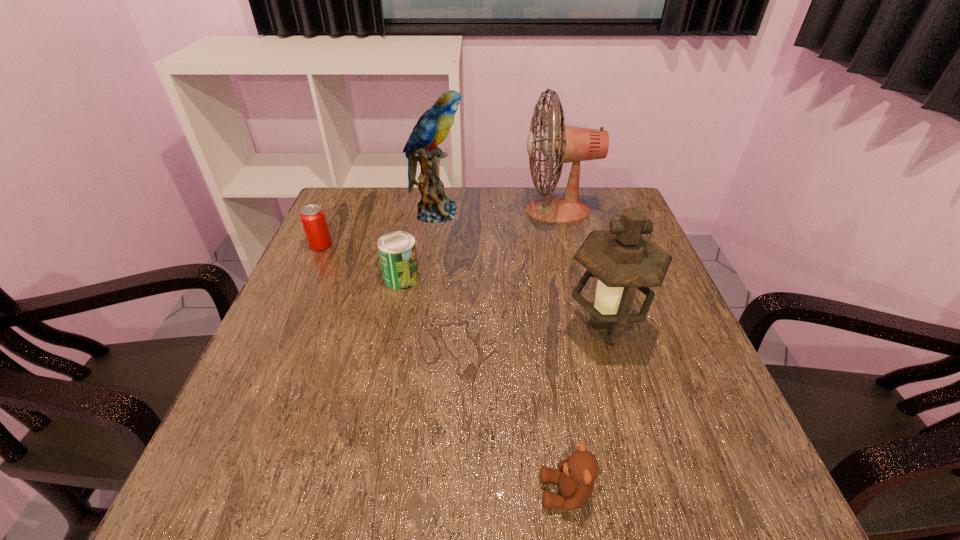
The width and height of the screenshot is (960, 540). I want to click on vacant space that is in between the third farthest object and the parrot, so click(378, 229).

At what (x,y) coordinates should I click in order to perform the action: click on empty space that is in between the parrot and the nearest object. Please return your answer as a coordinate pair (x, y). The height and width of the screenshot is (540, 960). Looking at the image, I should click on (501, 353).

This screenshot has width=960, height=540. Find the location of `free space that is in between the right can and the parrot`. free space that is in between the right can and the parrot is located at coordinates (419, 245).

Identify the location of free area in between the fan and the left can. pos(440,228).

Locate an element on the screen. free space between the right can and the nearest object is located at coordinates (484, 385).

Locate an element on the screen. free space between the parrot and the right can is located at coordinates (419, 245).

Find the location of a particular element. This screenshot has width=960, height=540. empty space that is in between the nearest object and the fan is located at coordinates (562, 352).

Identify the location of free spot between the third tallest object and the parrot. The width and height of the screenshot is (960, 540). (520, 271).

At what (x,y) coordinates should I click in order to perform the action: click on free space between the fan and the left can. Please return your answer as a coordinate pair (x, y). The width and height of the screenshot is (960, 540). Looking at the image, I should click on coord(440,228).

Where is `free spot between the nearer can and the nearest object`? free spot between the nearer can and the nearest object is located at coordinates (484, 385).